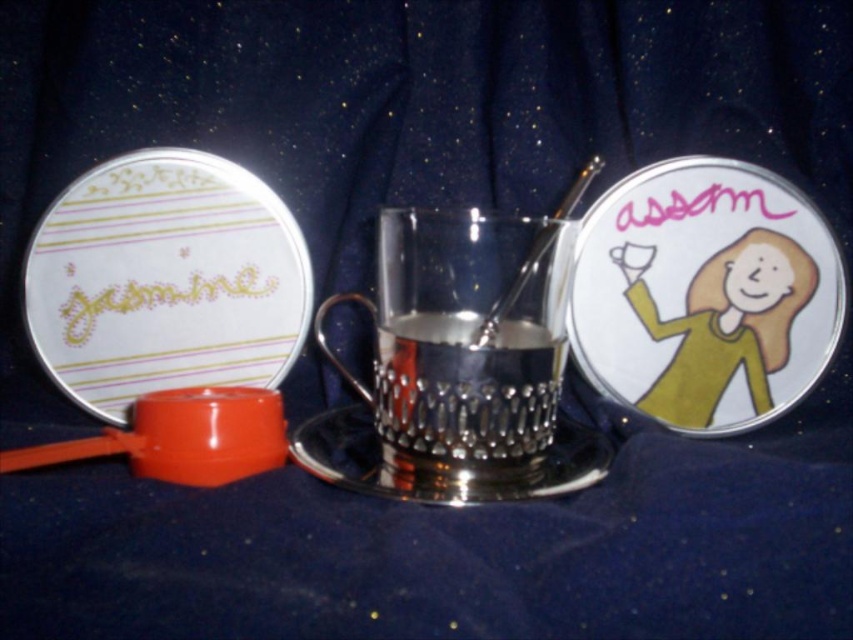
Which is behind, point (790, 362) or point (392, 467)?

Point (790, 362)

Does metallic silver plate at center have a greater height compared to silver textured saucer at center?

Yes, metallic silver plate at center is taller than silver textured saucer at center.

The height and width of the screenshot is (640, 853). Identify the location of metallic silver plate at center. (705, 294).

Who is positioned more to the left, polished silver cup at center or polished metal spoon at center?

polished silver cup at center

Is polished silver cup at center wider than polished metal spoon at center?

Yes, polished silver cup at center is wider than polished metal spoon at center.

Is point (488, 436) less distant than point (567, 189)?

Yes.

This screenshot has width=853, height=640. I want to click on polished silver cup at center, so click(463, 340).

Which of these two, matte white plate at left or polished metal spoon at center, stands taller?

matte white plate at left

Does matte white plate at left appear on the right side of polished metal spoon at center?

In fact, matte white plate at left is to the left of polished metal spoon at center.

Describe the element at coordinates (165, 280) in the screenshot. This screenshot has width=853, height=640. I see `matte white plate at left` at that location.

The width and height of the screenshot is (853, 640). In order to click on matte white plate at left in this screenshot , I will do `click(165, 280)`.